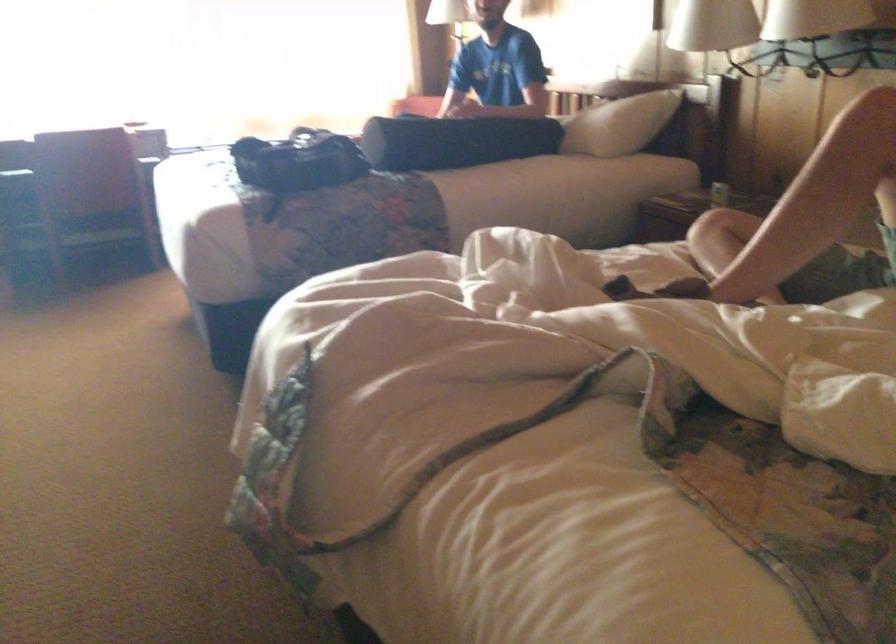
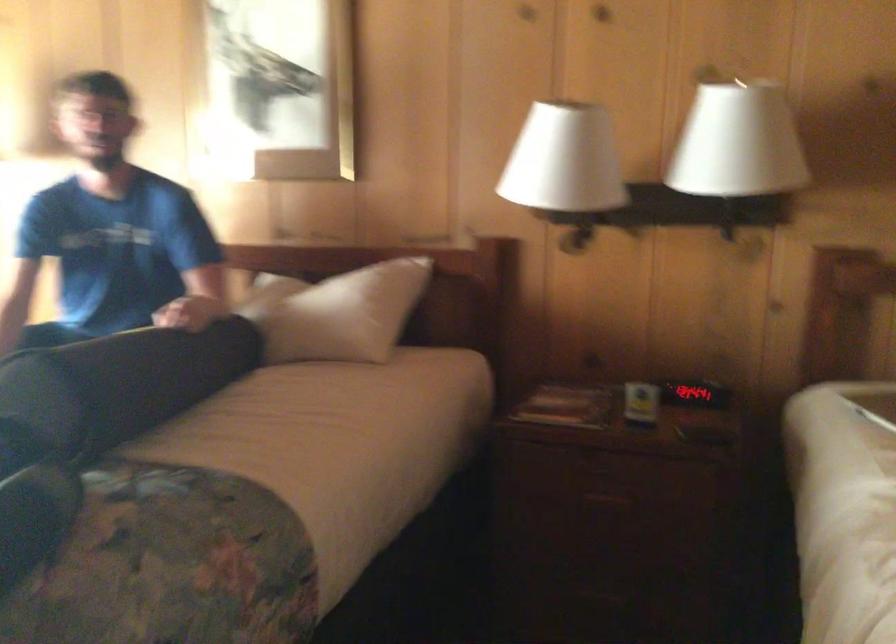
Question: I am providing you with two images of the same scene from different viewpoints. Please identify which objects are invisible in image2.

Choices:
 (A) white lamp shade
 (B) floral patterned pillow
 (C) white pillow
 (D) white storage basket

Answer: (C)